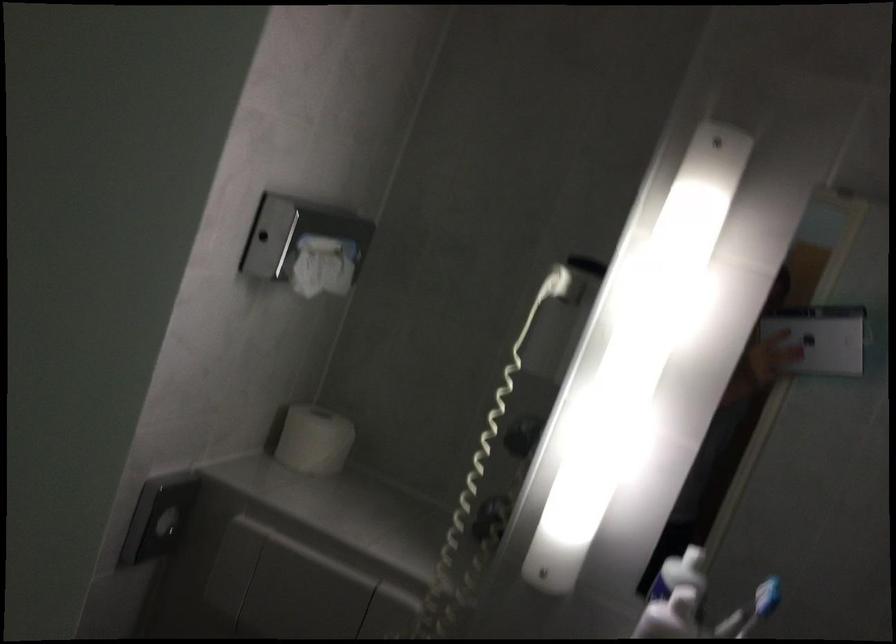
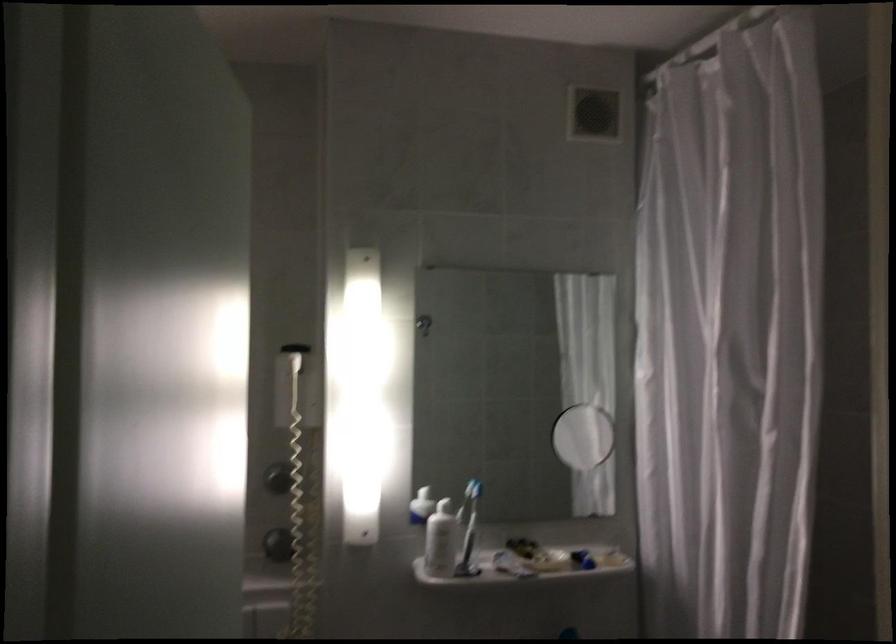
Find the pixel in the second image that matches the point at 565,328 in the first image.

(295, 386)